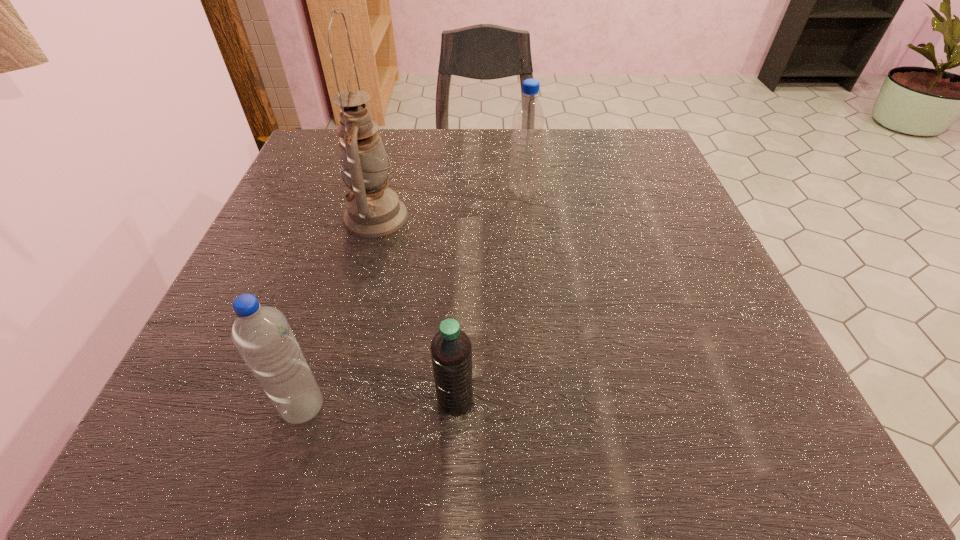
Select which object appears as the second closest to the farthest water bottle. Please provide its 2D coordinates. Your answer should be formatted as a tuple, i.e. [(x, y)], where the tuple contains the x and y coordinates of a point satisfying the conditions above.

[(451, 350)]

In order to click on water bottle object that ranks as the closest to the third object from left to right in this screenshot , I will do `click(262, 335)`.

Point out which water bottle is positioned as the third nearest to the oil lamp. Please provide its 2D coordinates. Your answer should be formatted as a tuple, i.e. [(x, y)], where the tuple contains the x and y coordinates of a point satisfying the conditions above.

[(451, 350)]

Locate an element on the screen. This screenshot has height=540, width=960. vacant region that satisfies the following two spatial constraints: 1. on the back side of the second water bottle from left to right; 2. on the right side of the leftmost water bottle is located at coordinates [x=304, y=401].